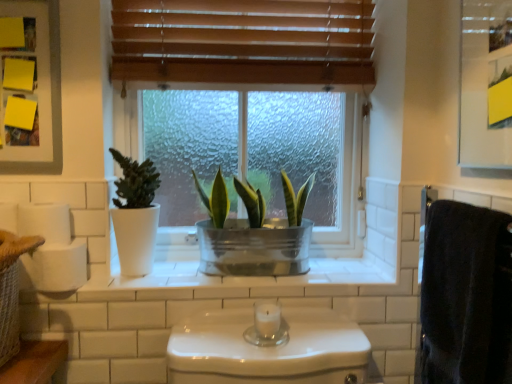
The height and width of the screenshot is (384, 512). Find the location of `metallic silver medicine cabinet at upper right, marked as the second medicine cabinet in a back-to-front arrangement`. metallic silver medicine cabinet at upper right, marked as the second medicine cabinet in a back-to-front arrangement is located at coordinates (485, 84).

The image size is (512, 384). Describe the element at coordinates (45, 221) in the screenshot. I see `white matte toilet paper at left` at that location.

What is the approximate width of wooden blinds at upper center?

wooden blinds at upper center is 3.77 inches in width.

In the scene shown: Measure the distance between metallic green plant at center, the first houseplant positioned from the right, and camera.

metallic green plant at center, the first houseplant positioned from the right, is 1.20 meters from camera.

Image resolution: width=512 pixels, height=384 pixels. Describe the element at coordinates (254, 233) in the screenshot. I see `metallic green plant at center, the second houseplant in the left-to-right sequence` at that location.

What do you see at coordinates (51, 108) in the screenshot? Image resolution: width=512 pixels, height=384 pixels. I see `yellow paper at upper left, marked as the first medicine cabinet in a left-to-right arrangement` at bounding box center [51, 108].

The image size is (512, 384). Describe the element at coordinates (135, 214) in the screenshot. I see `matte white pot at left, the first houseplant from the left` at that location.

In order to click on metallic silver medicine cabinet at upper right, marked as the second medicine cabinet in a back-to-front arrangement in this screenshot , I will do `click(485, 84)`.

Does black fuzzy bath towel at right lie in front of white matte toilet paper at left?

Yes, it is.

Could you tell me if black fuzzy bath towel at right is turned towards white matte toilet paper at left?

Yes, black fuzzy bath towel at right is turned towards white matte toilet paper at left.

Locate an element on the screen. bath towel below the white matte toilet paper at left (from the image's perspective) is located at coordinates (466, 295).

Between metallic green plant at center, the first houseplant positioned from the right, and yellow paper at upper left, marked as the first medicine cabinet in a left-to-right arrangement, which one has larger size?

metallic green plant at center, the first houseplant positioned from the right.

Which of these two, metallic green plant at center, the second houseplant in the left-to-right sequence, or yellow paper at upper left, marked as the first medicine cabinet in a left-to-right arrangement, is wider?

With larger width is metallic green plant at center, the second houseplant in the left-to-right sequence.

From a real-world perspective, is metallic green plant at center, the first houseplant positioned from the right, positioned under yellow paper at upper left, marked as the first medicine cabinet in a left-to-right arrangement, based on gravity?

Yes, from a real-world perspective, metallic green plant at center, the first houseplant positioned from the right, is beneath yellow paper at upper left, marked as the first medicine cabinet in a left-to-right arrangement.

Which is behind, point (285, 196) or point (10, 165)?

The point (285, 196) is farther.

This screenshot has width=512, height=384. In order to click on window blind located on the right of white matte toilet paper at left in this screenshot , I will do `click(243, 41)`.

From the image's perspective, is white matte toilet paper at left positioned above or below wooden blinds at upper center?

Based on their image positions, white matte toilet paper at left is located beneath wooden blinds at upper center.

Which is more to the left, white matte toilet paper at left or wooden blinds at upper center?

Positioned to the left is white matte toilet paper at left.

Is matte white pot at left, the first houseplant from the left, with metallic green plant at center, the first houseplant positioned from the right?

No, matte white pot at left, the first houseplant from the left, is not in contact with metallic green plant at center, the first houseplant positioned from the right.

Considering the sizes of objects matte white pot at left, the 2th houseplant positioned from the right, and metallic green plant at center, the second houseplant in the left-to-right sequence, in the image provided, who is thinner, matte white pot at left, the 2th houseplant positioned from the right, or metallic green plant at center, the second houseplant in the left-to-right sequence,?

With smaller width is matte white pot at left, the 2th houseplant positioned from the right.

The width and height of the screenshot is (512, 384). I want to click on houseplant below the matte white pot at left, the 2th houseplant positioned from the right (from the image's perspective), so click(x=254, y=233).

From the picture: Does matte white pot at left, the first houseplant from the left, lie in front of metallic green plant at center, the second houseplant in the left-to-right sequence?

Yes.

Which is more to the right, matte white pot at left, the first houseplant from the left, or black fuzzy bath towel at right?

Positioned to the right is black fuzzy bath towel at right.

Between point (150, 262) and point (473, 282), which one is positioned behind?

Positioned behind is point (150, 262).

Is matte white pot at left, the 2th houseplant positioned from the right, positioned behind black fuzzy bath towel at right?

Yes, the depth of matte white pot at left, the 2th houseplant positioned from the right, is greater than that of black fuzzy bath towel at right.

From the picture: Is there a large distance between matte white pot at left, the 2th houseplant positioned from the right, and black fuzzy bath towel at right?

Actually, matte white pot at left, the 2th houseplant positioned from the right, and black fuzzy bath towel at right are a little close together.

Is metallic green plant at center, the second houseplant in the left-to-right sequence, at the right side of wooden blinds at upper center?

Indeed, metallic green plant at center, the second houseplant in the left-to-right sequence, is positioned on the right side of wooden blinds at upper center.

Which of these two, metallic green plant at center, the first houseplant positioned from the right, or wooden blinds at upper center, is bigger?

wooden blinds at upper center.

Is wooden blinds at upper center at the back of metallic green plant at center, the second houseplant in the left-to-right sequence?

No, wooden blinds at upper center is not at the back of metallic green plant at center, the second houseplant in the left-to-right sequence.

Measure the distance between metallic silver medicine cabinet at upper right, which ranks as the 2th medicine cabinet in left-to-right order, and matte white pot at left, the 2th houseplant positioned from the right.

metallic silver medicine cabinet at upper right, which ranks as the 2th medicine cabinet in left-to-right order, and matte white pot at left, the 2th houseplant positioned from the right, are 34.56 inches apart.

Do you think metallic silver medicine cabinet at upper right, which ranks as the 2th medicine cabinet in left-to-right order, is within matte white pot at left, the first houseplant from the left, or outside of it?

metallic silver medicine cabinet at upper right, which ranks as the 2th medicine cabinet in left-to-right order, exists outside the volume of matte white pot at left, the first houseplant from the left.

Between metallic silver medicine cabinet at upper right, acting as the 1th medicine cabinet starting from the right, and matte white pot at left, the 2th houseplant positioned from the right, which one has more height?

Standing taller between the two is metallic silver medicine cabinet at upper right, acting as the 1th medicine cabinet starting from the right.

Considering the relative positions of metallic silver medicine cabinet at upper right, marked as the second medicine cabinet in a back-to-front arrangement, and matte white pot at left, the 2th houseplant positioned from the right, in the image provided, is metallic silver medicine cabinet at upper right, marked as the second medicine cabinet in a back-to-front arrangement, to the left or to the right of matte white pot at left, the 2th houseplant positioned from the right,?

metallic silver medicine cabinet at upper right, marked as the second medicine cabinet in a back-to-front arrangement, is positioned on matte white pot at left, the 2th houseplant positioned from the right,'s right side.

This screenshot has height=384, width=512. I want to click on bath towel on the right of the white matte toilet paper at left, so click(x=466, y=295).

There is a metallic green plant at center, the second houseplant in the left-to-right sequence. Where is `the 2nd medicine cabinet above it (from a real-world perspective)`? The width and height of the screenshot is (512, 384). the 2nd medicine cabinet above it (from a real-world perspective) is located at coordinates (51, 108).

Looking at the image, which one is located further to white matte toilet paper at left, metallic green plant at center, the second houseplant in the left-to-right sequence, or black fuzzy bath towel at right?

black fuzzy bath towel at right lies further to white matte toilet paper at left than the other object.

Looking at the image, which one is located further to white matte toilet paper at left, metallic silver medicine cabinet at upper right, acting as the 1th medicine cabinet starting from the right, or yellow paper at upper left, marked as the first medicine cabinet in a left-to-right arrangement?

metallic silver medicine cabinet at upper right, acting as the 1th medicine cabinet starting from the right, is positioned further to the anchor white matte toilet paper at left.

Looking at this image, estimate the real-world distances between objects in this image. Which object is closer to wooden blinds at upper center, white matte toilet paper at left or black fuzzy bath towel at right?

Among the two, white matte toilet paper at left is located nearer to wooden blinds at upper center.

Based on their spatial positions, is yellow paper at upper left, which is the 2th medicine cabinet from front to back, or metallic silver medicine cabinet at upper right, which ranks as the 2th medicine cabinet in left-to-right order, further from white matte toilet paper at left?

The object further to white matte toilet paper at left is metallic silver medicine cabinet at upper right, which ranks as the 2th medicine cabinet in left-to-right order.

Estimate the real-world distances between objects in this image. Which object is closer to metallic silver medicine cabinet at upper right, which ranks as the 2th medicine cabinet in left-to-right order, wooden blinds at upper center or yellow paper at upper left, arranged as the first medicine cabinet when viewed from the back?

Based on the image, wooden blinds at upper center appears to be nearer to metallic silver medicine cabinet at upper right, which ranks as the 2th medicine cabinet in left-to-right order.

When comparing their distances from matte white pot at left, the 2th houseplant positioned from the right, does metallic silver medicine cabinet at upper right, marked as the second medicine cabinet in a back-to-front arrangement, or yellow paper at upper left, arranged as the first medicine cabinet when viewed from the back, seem closer?

yellow paper at upper left, arranged as the first medicine cabinet when viewed from the back, is positioned closer to the anchor matte white pot at left, the 2th houseplant positioned from the right.

Consider the image. From the image, which object appears to be nearer to black fuzzy bath towel at right, white matte toilet paper at left or metallic silver medicine cabinet at upper right, which ranks as the 2th medicine cabinet in left-to-right order?

Among the two, metallic silver medicine cabinet at upper right, which ranks as the 2th medicine cabinet in left-to-right order, is located nearer to black fuzzy bath towel at right.

When comparing their distances from metallic silver medicine cabinet at upper right, which ranks as the 2th medicine cabinet in left-to-right order, does matte white pot at left, the 2th houseplant positioned from the right, or wooden blinds at upper center seem closer?

wooden blinds at upper center is closer to metallic silver medicine cabinet at upper right, which ranks as the 2th medicine cabinet in left-to-right order.

At what (x,y) coordinates should I click in order to perform the action: click on houseplant between matte white pot at left, the first houseplant from the left, and metallic silver medicine cabinet at upper right, which is counted as the first medicine cabinet, starting from the front, from left to right. Please return your answer as a coordinate pair (x, y). The width and height of the screenshot is (512, 384). Looking at the image, I should click on (254, 233).

I want to click on window blind between white matte toilet paper at left and black fuzzy bath towel at right, so click(243, 41).

You are a GUI agent. You are given a task and a screenshot of the screen. Output one action in this format:
    pyautogui.click(x=<x>, y=<y>)
    Task: Click on the houseplant between white matte toilet paper at left and metallic green plant at center, the first houseplant positioned from the right
    
    Given the screenshot: What is the action you would take?
    135,214

Identify the location of bath towel between matte white pot at left, the 2th houseplant positioned from the right, and metallic silver medicine cabinet at upper right, which is counted as the first medicine cabinet, starting from the front, from left to right. (466, 295).